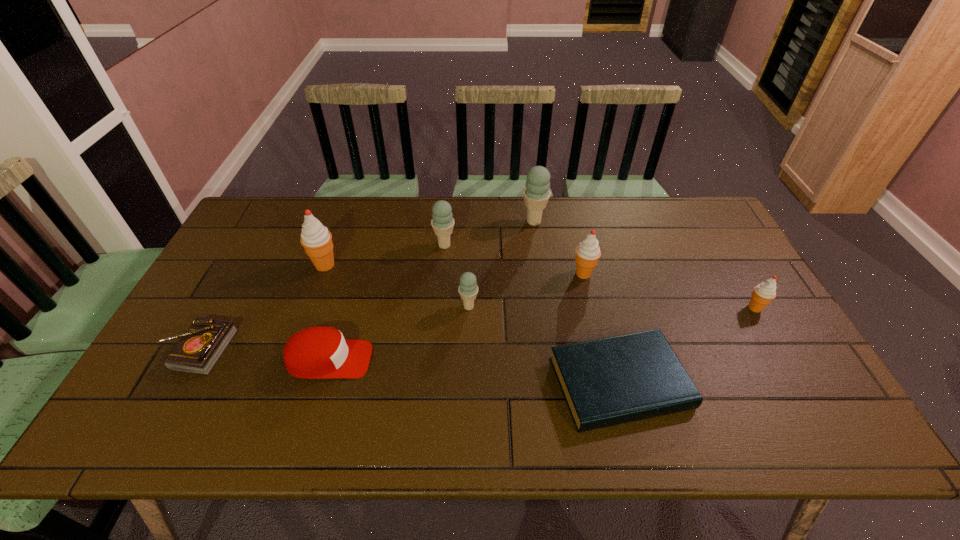
Where is `vacant position located 0.100m on the left of the nearest red icecream`? vacant position located 0.100m on the left of the nearest red icecream is located at coordinates (709, 308).

Image resolution: width=960 pixels, height=540 pixels. In order to click on vacant region located on the right of the fourth ice cream from right to left in this screenshot , I will do `click(521, 307)`.

The image size is (960, 540). Find the location of `vacant space located on the front-facing side of the baseball cap`. vacant space located on the front-facing side of the baseball cap is located at coordinates (439, 360).

The height and width of the screenshot is (540, 960). In order to click on vacant space located 0.370m on the back of the leftmost object in this screenshot , I will do `click(260, 238)`.

I want to click on vacant space positioned 0.100m on the right of the book, so click(x=729, y=383).

At what (x,y) coordinates should I click in order to perform the action: click on object at the near edge. Please return your answer as a coordinate pair (x, y). Looking at the image, I should click on (605, 382).

The image size is (960, 540). In order to click on object present at the left edge in this screenshot , I will do `click(199, 349)`.

Where is `object that is positioned at the right edge`? The image size is (960, 540). object that is positioned at the right edge is located at coordinates (765, 292).

The height and width of the screenshot is (540, 960). I want to click on free space at the far edge of the desktop, so click(x=336, y=217).

You are a GUI agent. You are given a task and a screenshot of the screen. Output one action in this format:
    pyautogui.click(x=<x>, y=<y>)
    Task: Click on the vacant space at the left edge
    This screenshot has height=540, width=960.
    Given the screenshot: What is the action you would take?
    pyautogui.click(x=280, y=242)